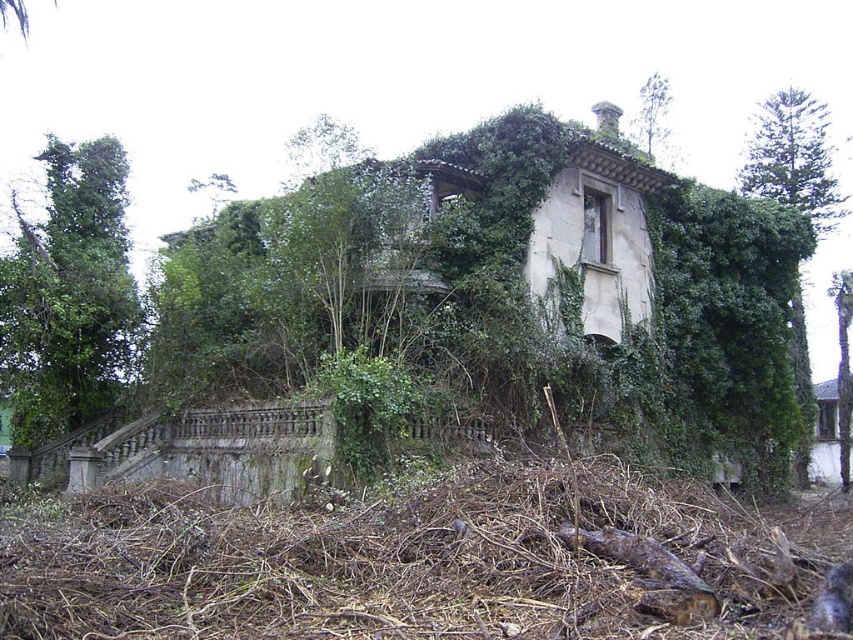
Is green leafy tree at right above green leafy tree at upper center?

No, green leafy tree at right is not above green leafy tree at upper center.

Is green leafy tree at right further to the viewer compared to green leafy tree at upper center?

Yes.

Does point (778, 179) come farther from viewer compared to point (665, 147)?

No.

Locate an element on the screen. green leafy tree at right is located at coordinates (793, 157).

Can you confirm if brown wood debris at lower center is positioned to the left of green leafy tree at upper center?

Indeed, brown wood debris at lower center is positioned on the left side of green leafy tree at upper center.

Which of these two, brown wood debris at lower center or green leafy tree at upper center, stands taller?

green leafy tree at upper center

Describe the element at coordinates (418, 564) in the screenshot. I see `brown wood debris at lower center` at that location.

You are a GUI agent. You are given a task and a screenshot of the screen. Output one action in this format:
    pyautogui.click(x=<x>, y=<y>)
    Task: Click on the brown wood debris at lower center
    This screenshot has width=853, height=640.
    Given the screenshot: What is the action you would take?
    pyautogui.click(x=418, y=564)

Can you confirm if green leafy tree at left is positioned to the right of green leafy tree at upper center?

In fact, green leafy tree at left is to the left of green leafy tree at upper center.

Between green leafy tree at left and green leafy tree at upper center, which one has more height?

green leafy tree at upper center

The height and width of the screenshot is (640, 853). In order to click on green leafy tree at left in this screenshot , I will do `click(68, 292)`.